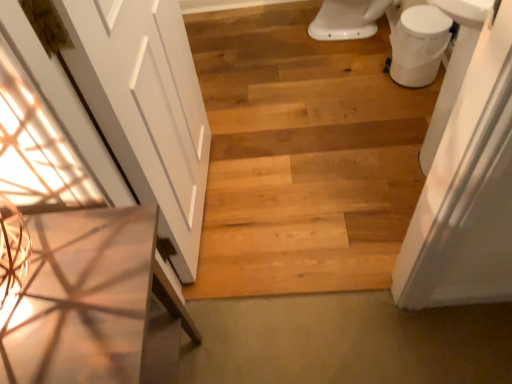
I want to click on vacant area on top of white glossy toilet bowl at upper right (from a real-world perspective), so click(426, 19).